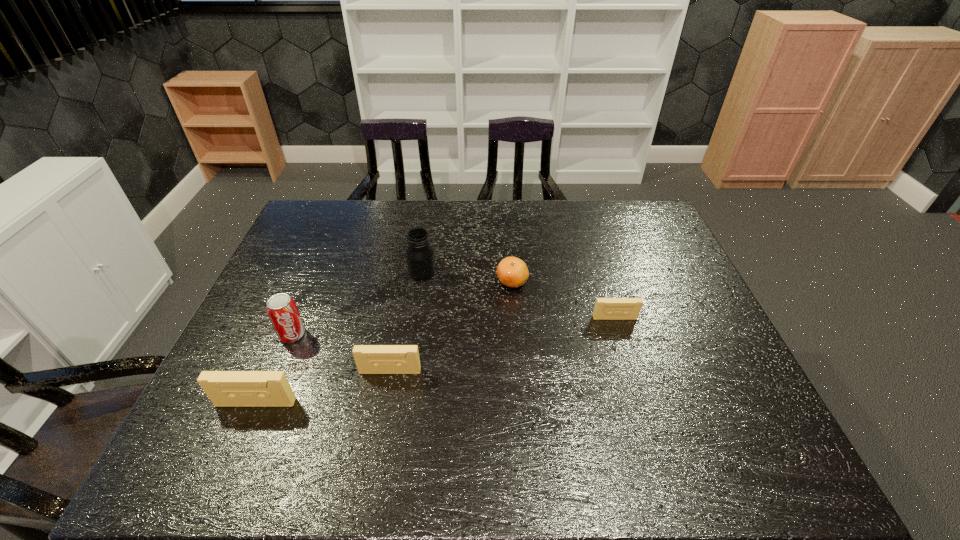
If we want them evenly spaced by inserting an extra videotape among them, please locate a free spot for this new videotape. Please provide its 2D coordinates. Your answer should be formatted as a tuple, i.e. [(x, y)], where the tuple contains the x and y coordinates of a point satisfying the conditions above.

[(509, 343)]